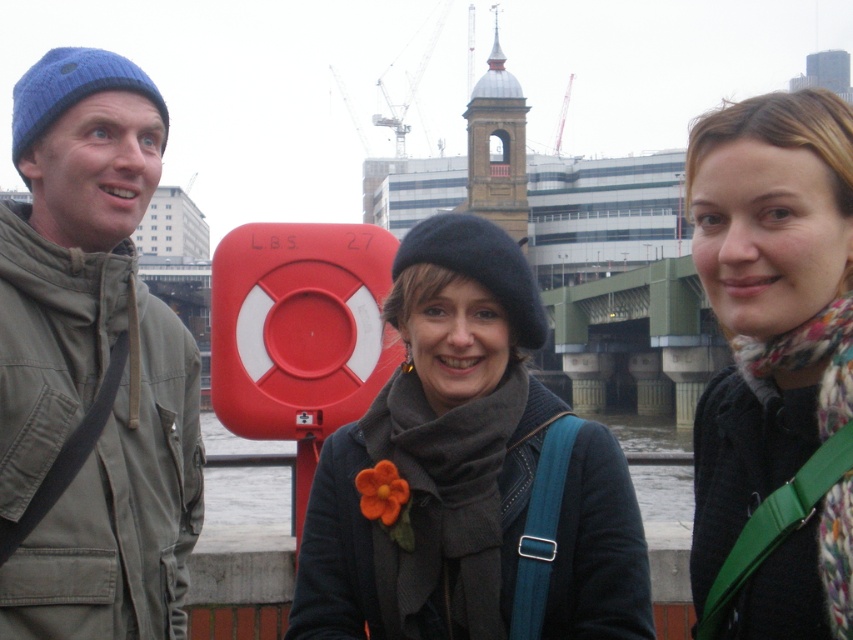
Question: Among these objects, which one is nearest to the camera?

Choices:
 (A) floral scarf at center
 (B) dark gray wool scarf at center

Answer: (A)

Question: Does knitted blue beanie at left appear on the left side of floral scarf at center?

Choices:
 (A) yes
 (B) no

Answer: (A)

Question: Estimate the real-world distances between objects in this image. Which object is closer to the knitted blue beanie at left?

Choices:
 (A) floral scarf at center
 (B) dark gray wool scarf at center

Answer: (B)

Question: Can you confirm if dark gray wool scarf at center is positioned below knitted blue beanie at left?

Choices:
 (A) yes
 (B) no

Answer: (A)

Question: Does dark gray wool scarf at center come behind knitted blue beanie at left?

Choices:
 (A) no
 (B) yes

Answer: (A)

Question: Which point appears closest to the camera in this image?

Choices:
 (A) (817, 488)
 (B) (1, 588)

Answer: (A)